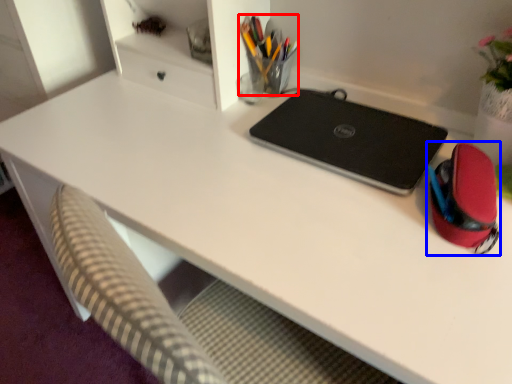
Question: Which of the following is the farthest to the observer, stationery (highlighted by a red box) or stationery (highlighted by a blue box)?

Choices:
 (A) stationery
 (B) stationery

Answer: (A)